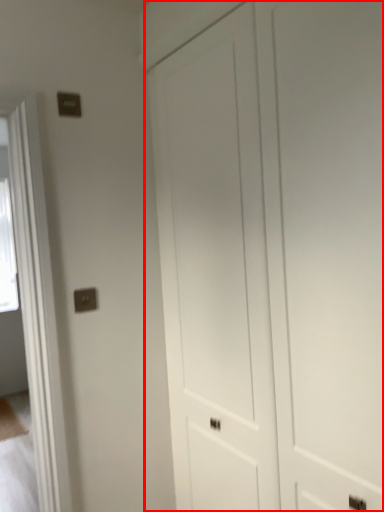
Question: From the image's perspective, where is door (annotated by the red box) located in relation to electric outlet in the image?

Choices:
 (A) above
 (B) below

Answer: (B)